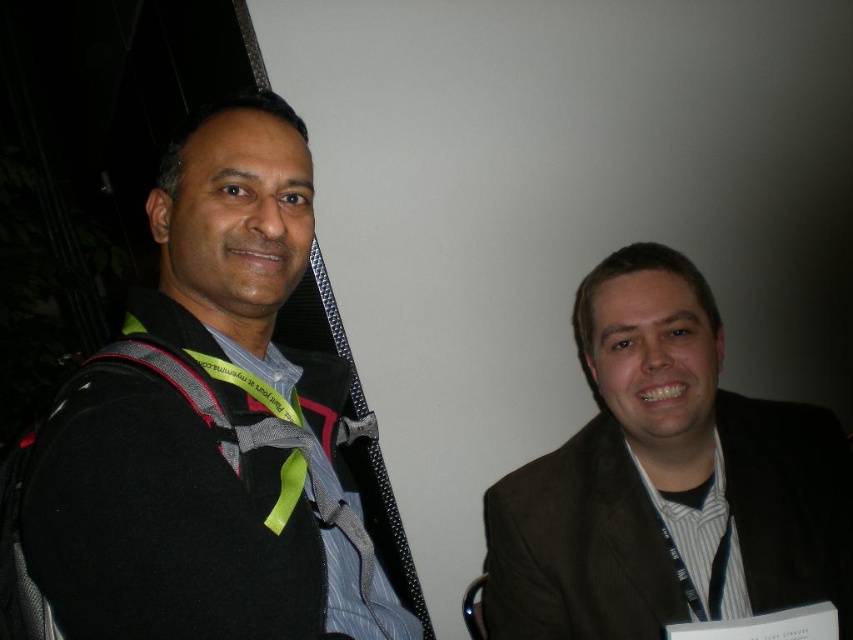
You are a photographer at the event and want to take a closeup of the yellow lanyard with text. The camera you are using has a focus point at coordinate point (201,433). Will this focus point land on the yellow lanyard with text?

The point (201,433) is on the black fabric backpack at left, so no, the focus point will not land on the yellow lanyard with text.

You are organizing a backpack and a suit for a trip. Given the image, which item from the black fabric backpack at left and the brown textured suit at right should you choose if you need more storage space?

The black fabric backpack at left is larger in size than the brown textured suit at right, so you should choose the black fabric backpack at left for more storage space.

You are organizing a backpack and suit storage area. The storage has a height limit of 1 meter. Given the black fabric backpack at left and brown textured suit at right, which item will exceed the height limit?

The black fabric backpack at left is taller than the brown textured suit at right. Since the storage has a height limit of 1 meter, the backpack may exceed the limit if its height is over 1 meter, but the suit would not.